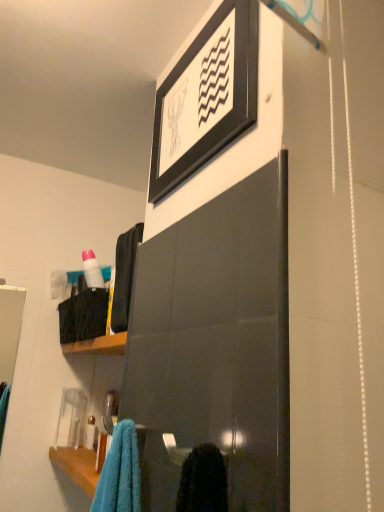
What do you see at coordinates (233, 97) in the screenshot? I see `black matte picture frame at upper center` at bounding box center [233, 97].

Measure the distance between point (170, 89) and camera.

They are 36.42 inches apart.

Where is `black matte picture frame at upper center`? black matte picture frame at upper center is located at coordinates (233, 97).

Find the location of a particular element. Image resolution: width=384 pixels, height=512 pixels. pink glossy lotion at upper left is located at coordinates (92, 270).

The height and width of the screenshot is (512, 384). What do you see at coordinates (92, 270) in the screenshot?
I see `pink glossy lotion at upper left` at bounding box center [92, 270].

Where is `black matte picture frame at upper center`? black matte picture frame at upper center is located at coordinates (233, 97).

Which is more to the right, pink glossy lotion at upper left or black matte picture frame at upper center?

black matte picture frame at upper center.

Is pink glossy lotion at upper left in front of or behind black matte picture frame at upper center in the image?

pink glossy lotion at upper left is positioned farther from the viewer than black matte picture frame at upper center.

Between point (102, 280) and point (212, 85), which one is positioned in front?

The point (212, 85) is in front.

From the image's perspective, who appears lower, pink glossy lotion at upper left or black matte picture frame at upper center?

pink glossy lotion at upper left appears lower in the image.

From a real-world perspective, is pink glossy lotion at upper left under black matte picture frame at upper center?

Yes, from a real-world perspective, pink glossy lotion at upper left is beneath black matte picture frame at upper center.

Looking at their sizes, would you say pink glossy lotion at upper left is wider or thinner than black matte picture frame at upper center?

Clearly, pink glossy lotion at upper left has more width compared to black matte picture frame at upper center.

Who is taller, pink glossy lotion at upper left or black matte picture frame at upper center?

Standing taller between the two is black matte picture frame at upper center.

Considering the sizes of objects pink glossy lotion at upper left and black matte picture frame at upper center in the image provided, who is smaller, pink glossy lotion at upper left or black matte picture frame at upper center?

Smaller between the two is pink glossy lotion at upper left.

Is black matte picture frame at upper center located within pink glossy lotion at upper left?

Definitely not — black matte picture frame at upper center is not inside pink glossy lotion at upper left.

Is pink glossy lotion at upper left with black matte picture frame at upper center?

No, pink glossy lotion at upper left is not touching black matte picture frame at upper center.

Is pink glossy lotion at upper left positioned with its back to black matte picture frame at upper center?

No, pink glossy lotion at upper left is not facing away from black matte picture frame at upper center.

How distant is pink glossy lotion at upper left from black matte picture frame at upper center?

pink glossy lotion at upper left is 20.90 inches away from black matte picture frame at upper center.

You are a GUI agent. You are given a task and a screenshot of the screen. Output one action in this format:
    pyautogui.click(x=<x>, y=<y>)
    Task: Click on the bottle that appears behind the black matte picture frame at upper center
    
    Given the screenshot: What is the action you would take?
    pyautogui.click(x=92, y=270)

Which object is positioned more to the right, black matte picture frame at upper center or pink glossy lotion at upper left?

black matte picture frame at upper center.

Considering the positions of objects black matte picture frame at upper center and pink glossy lotion at upper left in the image provided, who is in front, black matte picture frame at upper center or pink glossy lotion at upper left?

black matte picture frame at upper center is in front.

Is point (166, 176) closer to camera compared to point (94, 287)?

Yes, it is in front of point (94, 287).

From the image's perspective, does black matte picture frame at upper center appear lower than pink glossy lotion at upper left?

No, from the image's perspective, black matte picture frame at upper center is not beneath pink glossy lotion at upper left.

From a real-world perspective, is black matte picture frame at upper center positioned above or below pink glossy lotion at upper left?

black matte picture frame at upper center is situated higher than pink glossy lotion at upper left in the real world.

Which object is thinner, black matte picture frame at upper center or pink glossy lotion at upper left?

Thinner between the two is black matte picture frame at upper center.

Between black matte picture frame at upper center and pink glossy lotion at upper left, which one has less height?

Standing shorter between the two is pink glossy lotion at upper left.

Which of these two, black matte picture frame at upper center or pink glossy lotion at upper left, is smaller?

Smaller between the two is pink glossy lotion at upper left.

Is black matte picture frame at upper center not inside pink glossy lotion at upper left?

Yes, black matte picture frame at upper center is outside of pink glossy lotion at upper left.

Is black matte picture frame at upper center not close to pink glossy lotion at upper left?

They are positioned close to each other.

Is black matte picture frame at upper center oriented away from pink glossy lotion at upper left?

No.

How distant is black matte picture frame at upper center from pink glossy lotion at upper left?

black matte picture frame at upper center is 20.90 inches away from pink glossy lotion at upper left.

Find the location of a particular element. The width and height of the screenshot is (384, 512). bottle behind the black matte picture frame at upper center is located at coordinates (92, 270).

Where is `picture frame that is on the right side of pink glossy lotion at upper left`? This screenshot has width=384, height=512. picture frame that is on the right side of pink glossy lotion at upper left is located at coordinates (233, 97).

The image size is (384, 512). In order to click on bottle lying below the black matte picture frame at upper center (from the image's perspective) in this screenshot , I will do `click(92, 270)`.